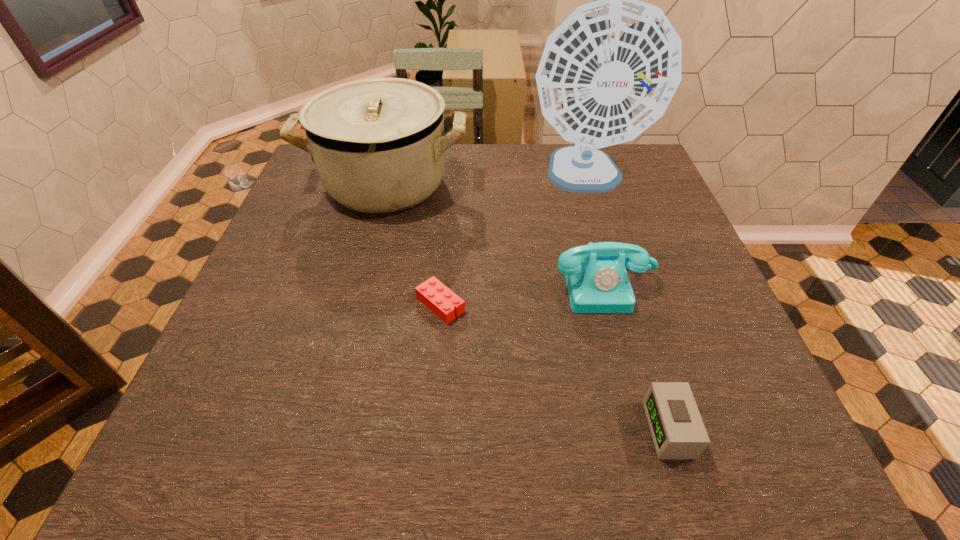
At what (x,y) coordinates should I click in order to perform the action: click on vacant space situated 0.400m on the front-facing side of the nearest object. Please return your answer as a coordinate pair (x, y). Image resolution: width=960 pixels, height=540 pixels. Looking at the image, I should click on (413, 429).

The height and width of the screenshot is (540, 960). I want to click on vacant space located 0.320m on the front-facing side of the nearest object, so click(460, 429).

At what (x,y) coordinates should I click in order to perform the action: click on free space located 0.100m on the right of the shortest object. Please return your answer as a coordinate pair (x, y). Looking at the image, I should click on (513, 305).

Find the location of `fan at the far edge`. fan at the far edge is located at coordinates (609, 71).

The height and width of the screenshot is (540, 960). What are the coordinates of `saucepan present at the far edge` in the screenshot? It's located at (378, 144).

The height and width of the screenshot is (540, 960). Find the location of `object positioned at the near edge`. object positioned at the near edge is located at coordinates (678, 432).

At what (x,y) coordinates should I click in order to perform the action: click on object at the left edge. Please return your answer as a coordinate pair (x, y). Image resolution: width=960 pixels, height=540 pixels. Looking at the image, I should click on 378,144.

The width and height of the screenshot is (960, 540). Identify the location of fan located in the right edge section of the desktop. (609, 71).

Find the location of `telephone that is at the right edge`. telephone that is at the right edge is located at coordinates (597, 281).

At what (x,y) coordinates should I click in order to perform the action: click on alarm clock present at the right edge. Please return your answer as a coordinate pair (x, y). Image resolution: width=960 pixels, height=540 pixels. Looking at the image, I should click on (678, 432).